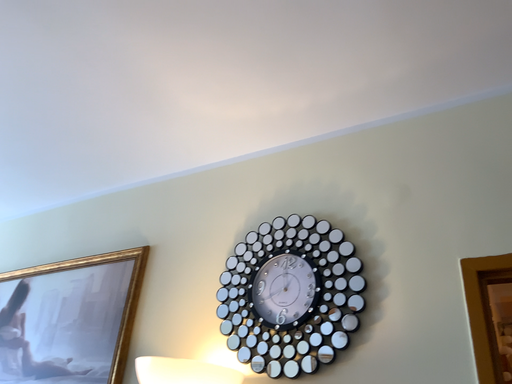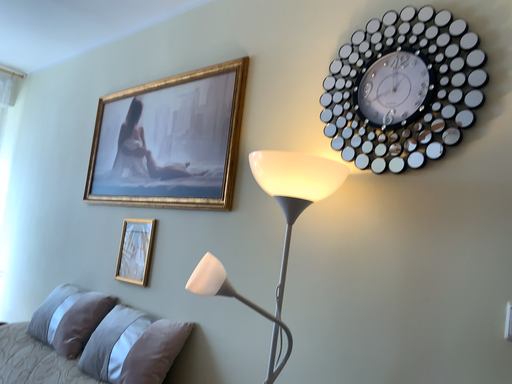
Question: Which way did the camera rotate in the video?

Choices:
 (A) rotated right
 (B) rotated left

Answer: (B)